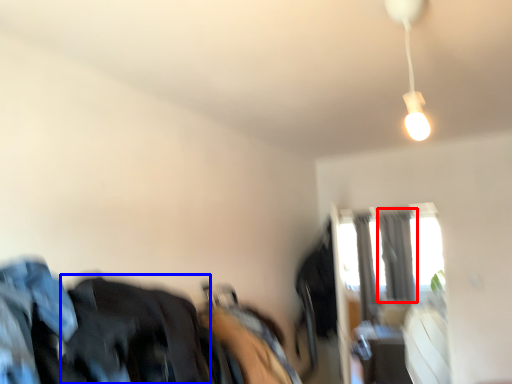
Question: Which point is closer to the camera, curtain (highlighted by a red box) or clothing (highlighted by a blue box)?

Choices:
 (A) curtain
 (B) clothing

Answer: (B)